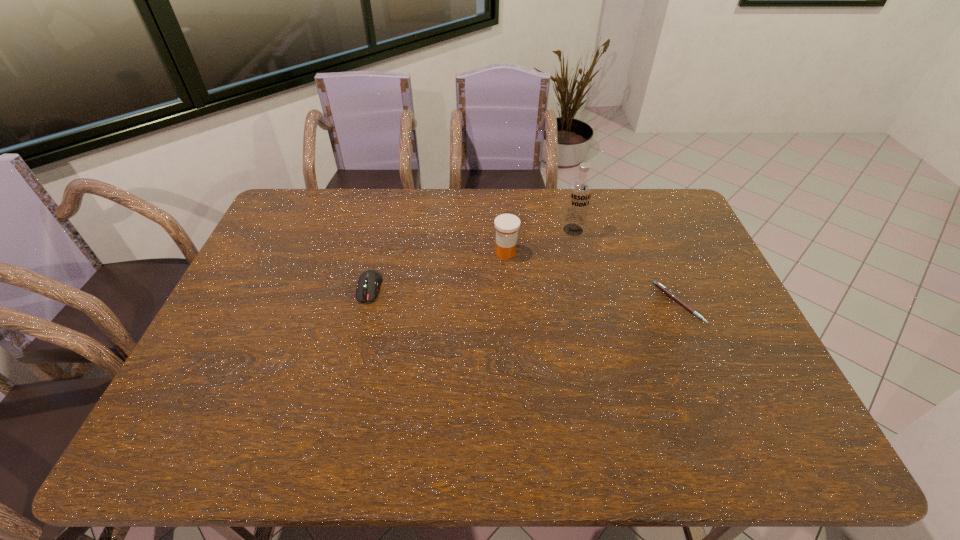
In the image, there is a desktop. What are the coordinates of `vacant space at the left edge` in the screenshot? It's located at (295, 254).

I want to click on vacant space at the right edge of the desktop, so click(x=720, y=364).

You are a GUI agent. You are given a task and a screenshot of the screen. Output one action in this format:
    pyautogui.click(x=<x>, y=<y>)
    Task: Click on the blank space at the far right corner of the desktop
    This screenshot has width=960, height=540.
    Given the screenshot: What is the action you would take?
    pyautogui.click(x=666, y=218)

Image resolution: width=960 pixels, height=540 pixels. Identify the location of vacant area between the tallest object and the shortest object. (626, 267).

Locate an element on the screen. free space between the third object from left to right and the third nearest object is located at coordinates (540, 241).

Identify the location of vacant area between the third shortest object and the farthest object. This screenshot has height=540, width=960. (540, 241).

Image resolution: width=960 pixels, height=540 pixels. Identify the location of vacant area that lies between the pen and the vodka. (626, 267).

The height and width of the screenshot is (540, 960). What are the coordinates of `free area in between the computer equipment and the shortest object` in the screenshot? It's located at (524, 295).

The image size is (960, 540). Find the location of `vacant space in between the third object from left to right and the pen`. vacant space in between the third object from left to right and the pen is located at coordinates (626, 267).

The width and height of the screenshot is (960, 540). In order to click on free spot between the tallest object and the shortest object in this screenshot , I will do `click(626, 267)`.